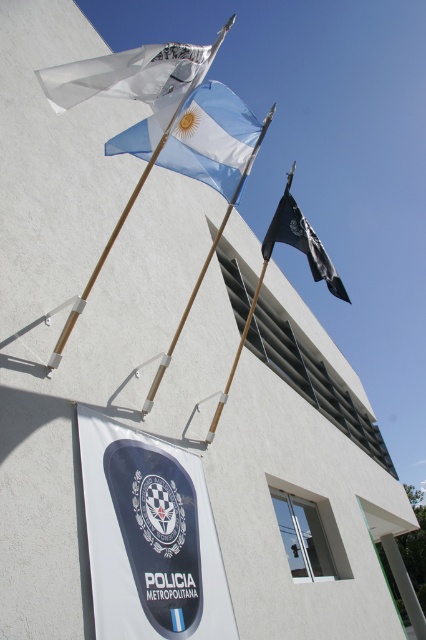
Question: Can you confirm if white fabric flag pole at upper left is thinner than black matte flag at upper center?

Choices:
 (A) no
 (B) yes

Answer: (A)

Question: Which of the following is the farthest from the observer?

Choices:
 (A) white fabric flag at upper left
 (B) black glossy emblem at center
 (C) wooden pole at center
 (D) wooden flag pole at center

Answer: (D)

Question: Where is blue fabric flag at upper center located in relation to white fabric flag at upper left in the image?

Choices:
 (A) right
 (B) left

Answer: (A)

Question: Which point appears closest to the camera in this image?

Choices:
 (A) (167, 554)
 (B) (109, 65)

Answer: (B)

Question: Which object is farther from the camera taking this photo?

Choices:
 (A) white fabric flag pole at upper left
 (B) wooden flag pole at center

Answer: (B)

Question: Is white fabric flag pole at upper left wider than white fabric flag at upper left?

Choices:
 (A) no
 (B) yes

Answer: (B)